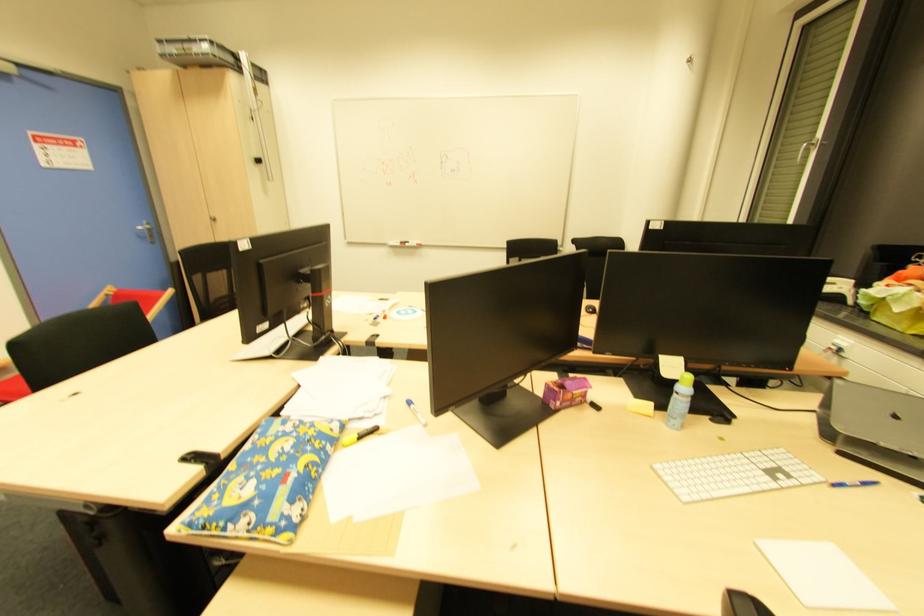
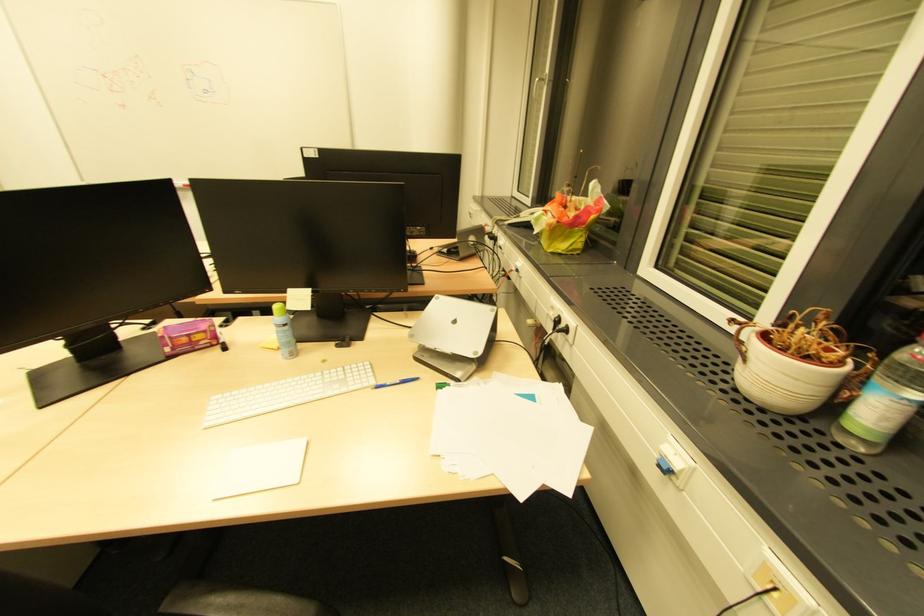
The point at (895,418) is marked in the first image. Where is the corresponding point in the second image?

(455, 323)